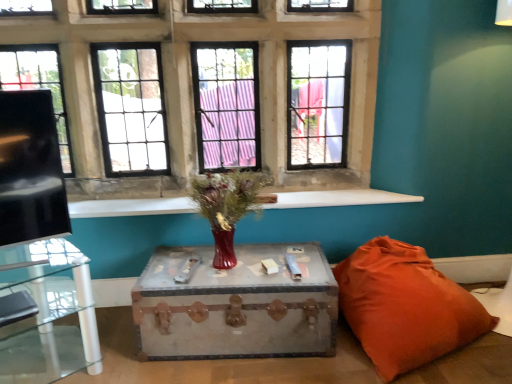
What are the coordinates of `free point above rustic metal trunk at center, positioned as the 2th table in left-to-right order (from a real-world perspective)` in the screenshot? It's located at (242, 272).